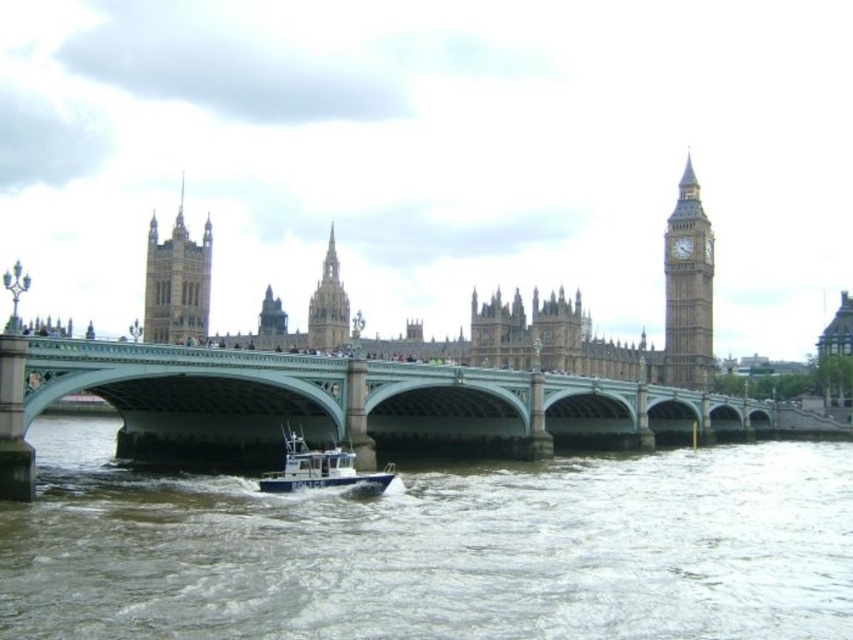
Question: In this image, where is green stone bridge at center located relative to golden stone tower at upper left?

Choices:
 (A) above
 (B) below

Answer: (B)

Question: Which of the following is the farthest from the observer?

Choices:
 (A) white plastic boat at center
 (B) brown water at lower center
 (C) brown stone clock tower at right

Answer: (C)

Question: Is green stone bridge at center below white plastic boat at center?

Choices:
 (A) no
 (B) yes

Answer: (B)

Question: Which is farther from the white plastic boat at center?

Choices:
 (A) brown stone clock tower at right
 (B) golden stone tower at upper left

Answer: (B)

Question: Is green stone bridge at center positioned in front of golden stone spire at center?

Choices:
 (A) no
 (B) yes

Answer: (B)

Question: Which object appears farthest from the camera in this image?

Choices:
 (A) golden stone tower at upper left
 (B) green stone bridge at center

Answer: (A)